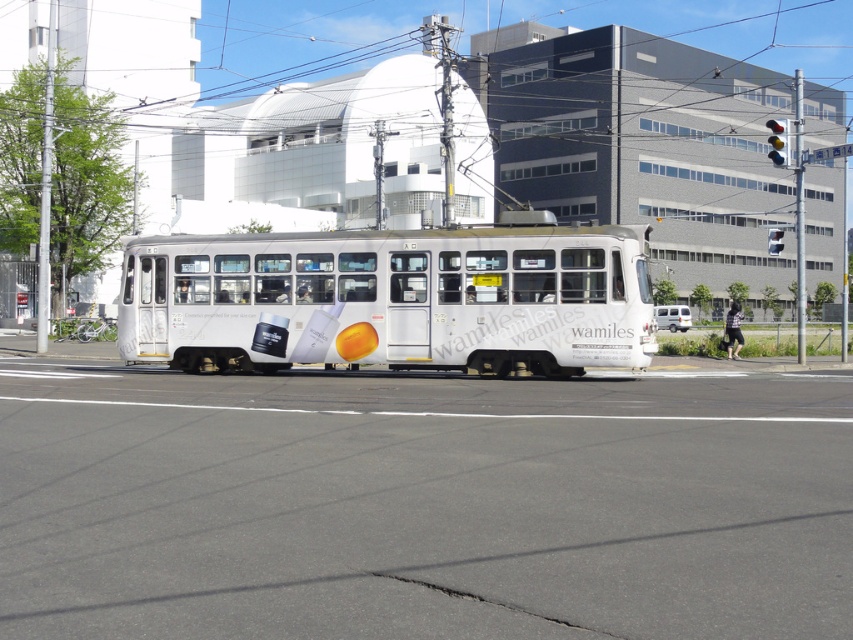
You are a delivery person who needs to load a tall package into a vehicle. You see the white glossy bus at center and the white matte van at center. Which vehicle should you choose to load your tall package?

The white glossy bus at center is much taller as white matte van at center, so you should choose the white glossy bus at center to load your tall package.